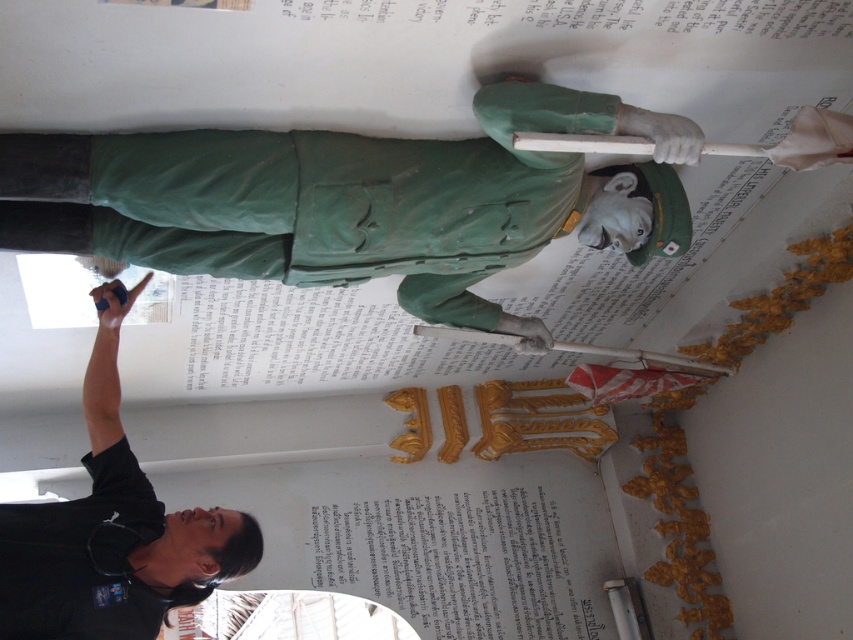
Question: Can you confirm if matte green statue at upper center is positioned to the right of black matte shirt at lower left?

Choices:
 (A) yes
 (B) no

Answer: (A)

Question: Which of the following is the farthest from the observer?

Choices:
 (A) matte green statue at upper center
 (B) black matte shirt at lower left

Answer: (B)

Question: Does matte green statue at upper center have a smaller size compared to black matte shirt at lower left?

Choices:
 (A) yes
 (B) no

Answer: (B)

Question: Does matte green statue at upper center appear over black matte shirt at lower left?

Choices:
 (A) yes
 (B) no

Answer: (A)